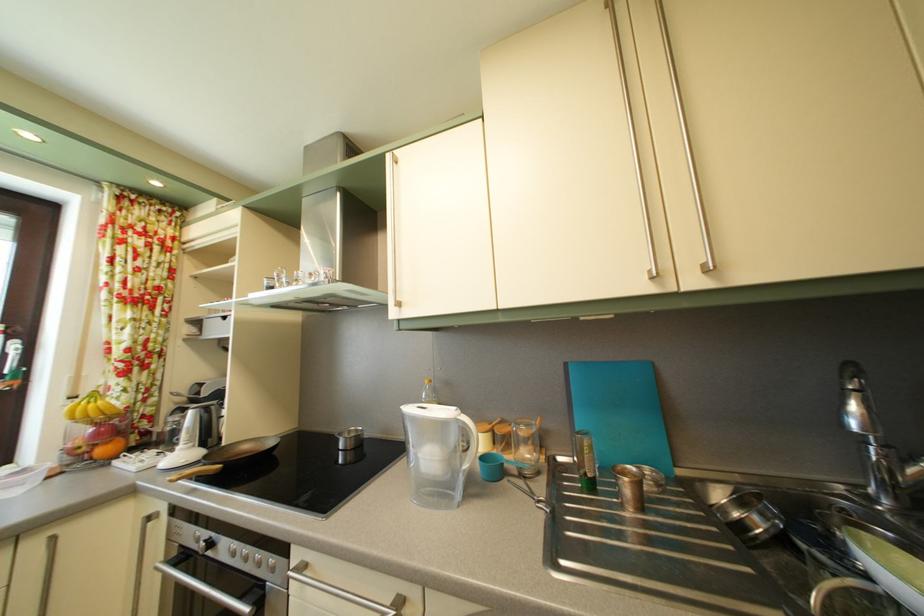
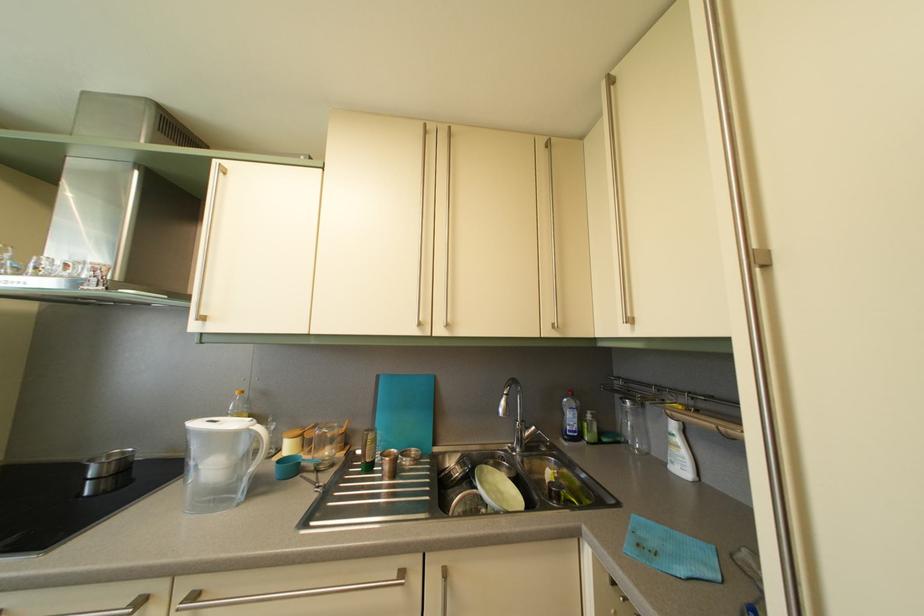
In the second image, find the point that corresponds to pixel 701 290 in the first image.

(447, 339)